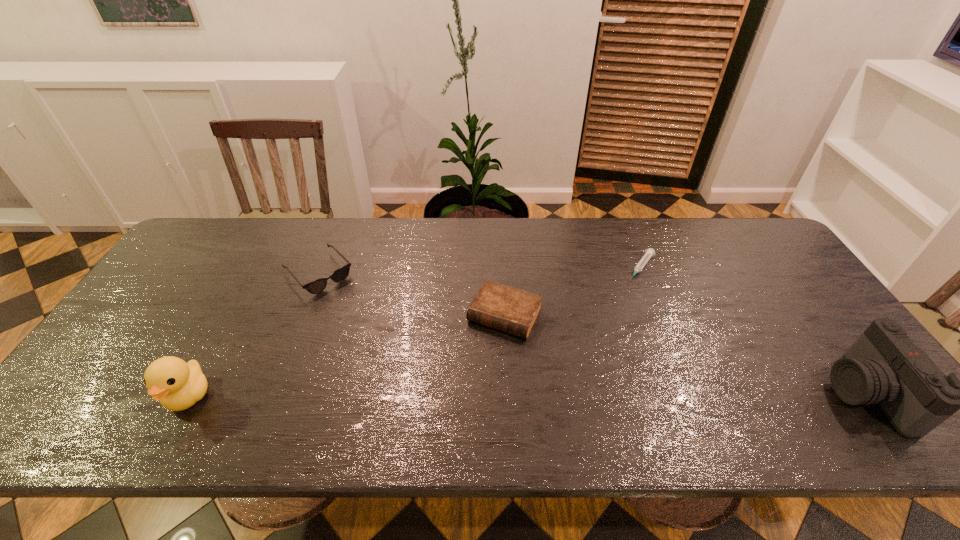
The height and width of the screenshot is (540, 960). Find the location of `vacant spot on the desktop that is between the leftmost object and the camera and is positioned at the needle end of the shortest object`. vacant spot on the desktop that is between the leftmost object and the camera and is positioned at the needle end of the shortest object is located at coordinates (548, 395).

This screenshot has height=540, width=960. Find the location of `free space on the desktop that is between the duck and the rightmost object and is positioned on the spine side of the diary`. free space on the desktop that is between the duck and the rightmost object and is positioned on the spine side of the diary is located at coordinates (463, 395).

At what (x,y) coordinates should I click in order to perform the action: click on vacant spot on the desktop that is between the duck and the camera and is positioned on the front lenses of the sunglasses. Please return your answer as a coordinate pair (x, y). This screenshot has height=540, width=960. Looking at the image, I should click on (430, 395).